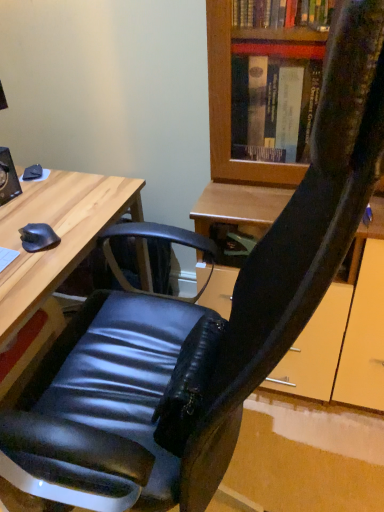
Describe the element at coordinates (38, 237) in the screenshot. This screenshot has width=384, height=512. I see `matte black mouse at left` at that location.

Measure the distance between point (46, 234) and camera.

The depth of point (46, 234) is 3.52 feet.

What are the coordinates of `matte black mouse at left` in the screenshot? It's located at (38, 237).

Image resolution: width=384 pixels, height=512 pixels. I want to click on wooden desk at left, so click(x=58, y=234).

What do you see at coordinates (58, 234) in the screenshot? I see `wooden desk at left` at bounding box center [58, 234].

Where is `matte black mouse at left`? The height and width of the screenshot is (512, 384). matte black mouse at left is located at coordinates (38, 237).

Would you say wooden desk at left is to the left or to the right of matte black mouse at left in the picture?

Based on their positions, wooden desk at left is located to the left of matte black mouse at left.

Is wooden desk at left closer to the viewer compared to matte black mouse at left?

Yes, the depth of wooden desk at left is less than that of matte black mouse at left.

Does point (109, 193) lie behind point (26, 240)?

Yes, point (109, 193) is behind point (26, 240).

Looking at this image, from the image's perspective, is wooden desk at left beneath matte black mouse at left?

Indeed, from the image's perspective, wooden desk at left is shown beneath matte black mouse at left.

From a real-world perspective, is wooden desk at left above or below matte black mouse at left?

wooden desk at left is situated lower than matte black mouse at left in the real world.

Which of these two, wooden desk at left or matte black mouse at left, is thinner?

matte black mouse at left is thinner.

Which of these two, wooden desk at left or matte black mouse at left, stands shorter?

matte black mouse at left.

Considering the sizes of wooden desk at left and matte black mouse at left in the image, is wooden desk at left bigger or smaller than matte black mouse at left?

Considering their sizes, wooden desk at left takes up more space than matte black mouse at left.

Can we say wooden desk at left lies outside matte black mouse at left?

wooden desk at left is positioned outside matte black mouse at left.

Is the surface of wooden desk at left in direct contact with matte black mouse at left?

No, wooden desk at left is not next to matte black mouse at left.

Is wooden desk at left looking in the opposite direction of matte black mouse at left?

wooden desk at left does not have its back to matte black mouse at left.

Where is `mouse above the wooden desk at left (from the image's perspective)`? This screenshot has width=384, height=512. mouse above the wooden desk at left (from the image's perspective) is located at coordinates point(38,237).

Which object is positioned more to the right, matte black mouse at left or wooden desk at left?

matte black mouse at left.

Is the depth of matte black mouse at left less than that of wooden desk at left?

No, matte black mouse at left is further to the viewer.

Does point (49, 238) lie in front of point (53, 273)?

No, (49, 238) is behind (53, 273).

From the image's perspective, is matte black mouse at left above or below wooden desk at left?

Based on their image positions, matte black mouse at left is located above wooden desk at left.

From a real-world perspective, is matte black mouse at left positioned under wooden desk at left based on gravity?

No.

From the picture: Between matte black mouse at left and wooden desk at left, which one has smaller width?

Thinner between the two is matte black mouse at left.

Which of these two, matte black mouse at left or wooden desk at left, stands shorter?

Standing shorter between the two is matte black mouse at left.

Considering the sizes of objects matte black mouse at left and wooden desk at left in the image provided, who is bigger, matte black mouse at left or wooden desk at left?

wooden desk at left.

Can wooden desk at left be found inside matte black mouse at left?

No, wooden desk at left is not surrounded by matte black mouse at left.

Is there a large distance between matte black mouse at left and wooden desk at left?

Actually, matte black mouse at left and wooden desk at left are a little close together.

Looking at this image, is wooden desk at left at the back of matte black mouse at left?

No, matte black mouse at left is not facing the opposite direction of wooden desk at left.

Identify the location of mouse on the right of wooden desk at left. The height and width of the screenshot is (512, 384). (38, 237).

The image size is (384, 512). Find the location of `mouse positioned vertically above the wooden desk at left (from a real-world perspective)`. mouse positioned vertically above the wooden desk at left (from a real-world perspective) is located at coordinates (38, 237).

Identify the location of mouse that appears above the wooden desk at left (from the image's perspective). (38, 237).